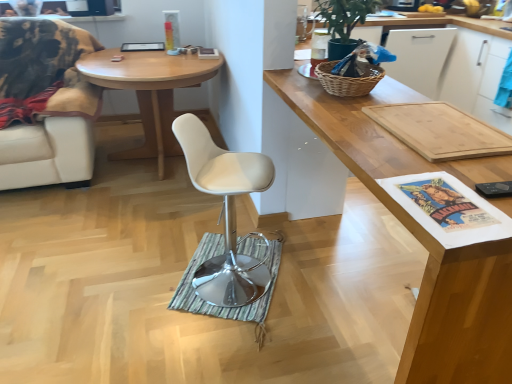
Locate an element on the screen. The image size is (512, 384). free space below wooden cutting board at upper right (from a real-world perspective) is located at coordinates (345, 291).